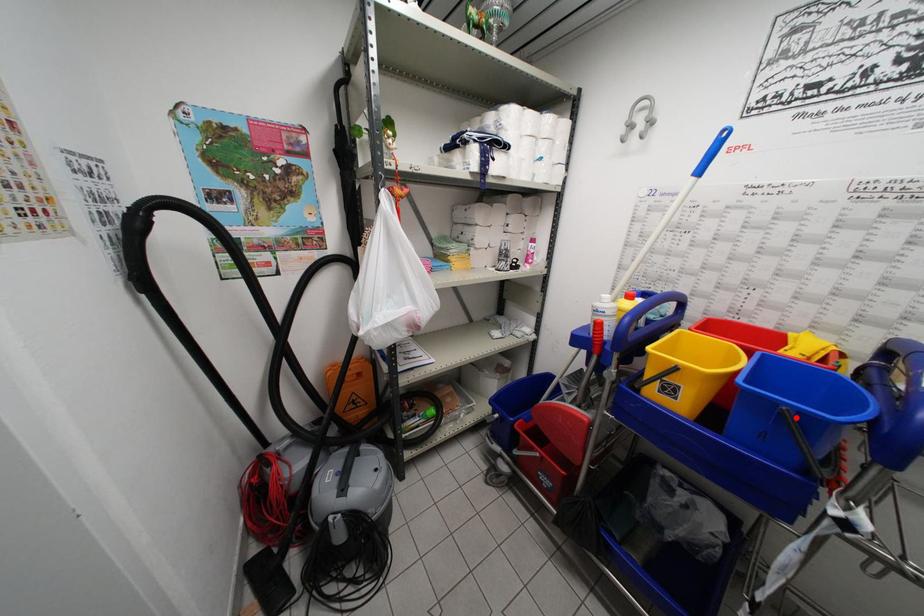
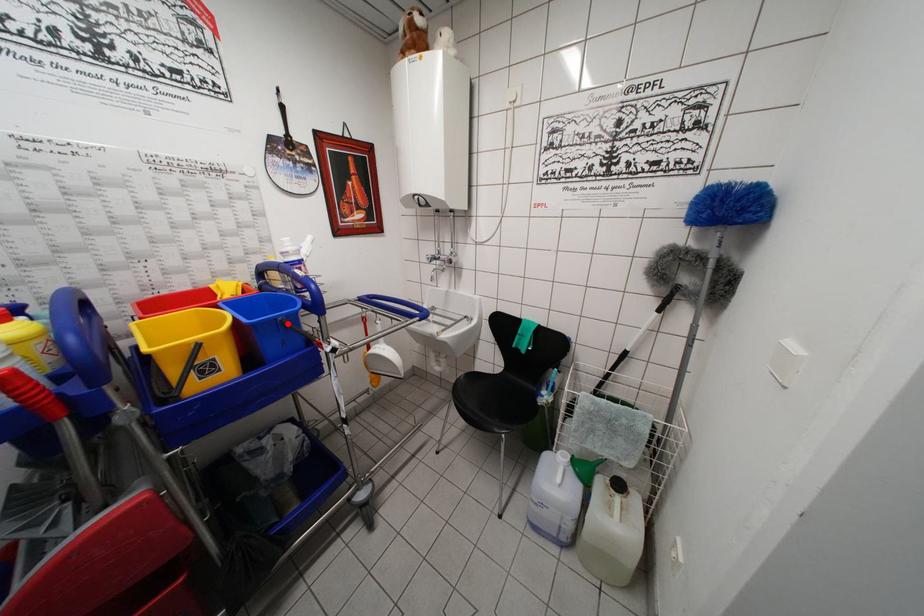
I am providing you with two images of the same scene from different viewpoints. A red point is marked on the first image and another point is marked on the second image. Do the highlighted points in image1 and image2 indicate the same real-world spot?

Yes